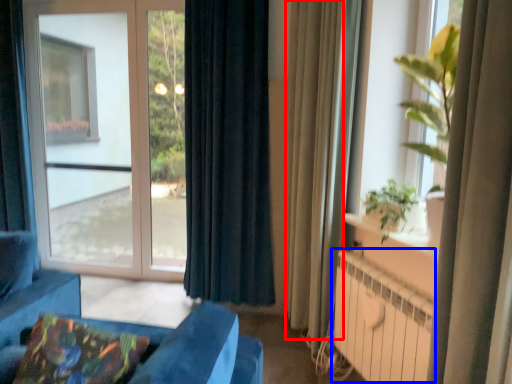
Question: Which object is further to the camera taking this photo, curtain (highlighted by a red box) or radiator (highlighted by a blue box)?

Choices:
 (A) curtain
 (B) radiator

Answer: (A)